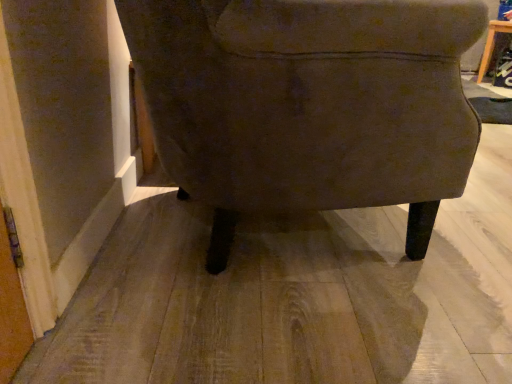
Question: Considering the relative sizes of matte brown fabric chair at center and wooden table at upper right in the image provided, is matte brown fabric chair at center shorter than wooden table at upper right?

Choices:
 (A) no
 (B) yes

Answer: (A)

Question: Would you say wooden table at upper right is part of matte brown fabric chair at center's contents?

Choices:
 (A) no
 (B) yes

Answer: (A)

Question: From the image's perspective, is matte brown fabric chair at center on wooden table at upper right?

Choices:
 (A) yes
 (B) no

Answer: (B)

Question: Is the position of matte brown fabric chair at center less distant than that of wooden table at upper right?

Choices:
 (A) yes
 (B) no

Answer: (A)

Question: Is matte brown fabric chair at center directly adjacent to wooden table at upper right?

Choices:
 (A) yes
 (B) no

Answer: (B)

Question: Can you confirm if matte brown fabric chair at center is taller than wooden table at upper right?

Choices:
 (A) yes
 (B) no

Answer: (A)

Question: From the image's perspective, would you say wooden table at upper right is shown under matte brown fabric chair at center?

Choices:
 (A) yes
 (B) no

Answer: (B)

Question: Is wooden table at upper right thinner than matte brown fabric chair at center?

Choices:
 (A) no
 (B) yes

Answer: (B)

Question: From a real-world perspective, is wooden table at upper right beneath matte brown fabric chair at center?

Choices:
 (A) yes
 (B) no

Answer: (A)

Question: Does wooden table at upper right appear on the right side of matte brown fabric chair at center?

Choices:
 (A) no
 (B) yes

Answer: (B)

Question: From a real-world perspective, is wooden table at upper right positioned over matte brown fabric chair at center based on gravity?

Choices:
 (A) yes
 (B) no

Answer: (B)

Question: Is wooden table at upper right next to matte brown fabric chair at center?

Choices:
 (A) no
 (B) yes

Answer: (A)

Question: Is point (497, 26) positioned closer to the camera than point (183, 74)?

Choices:
 (A) closer
 (B) farther

Answer: (B)